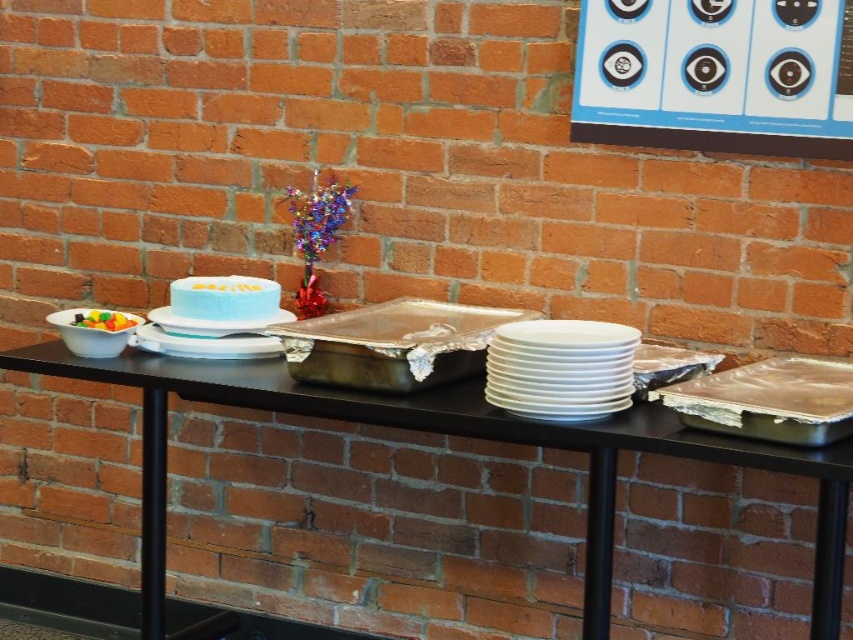
You are a delivery person standing 1.5 meters away from the table. You need to place a package on the silver metallic tray at center. Can you reach it without moving closer?

The silver metallic tray at center is 1.89 meters away from the viewer. Since you are already 1.5 meters away, you are still 0.39 meters away from the tray. You might need to move closer to reach it comfortably.

You are planning to place a blue frosted cake at center on a silver metallic tray at center. Based on the scene description, will the cake fit on the tray?

The silver metallic tray at center is larger in size than blue frosted cake at center, so the cake will fit on the tray.

You have a small toy car that is 10 cm long. You want to place it on the table so that it can fit entirely within either the silver metallic tray at center or the translucent plastic bowl at left. Based on their sizes, which object would you choose?

The silver metallic tray at center is wider than the translucent plastic bowl at left, so the toy car would fit better on the silver metallic tray at center.